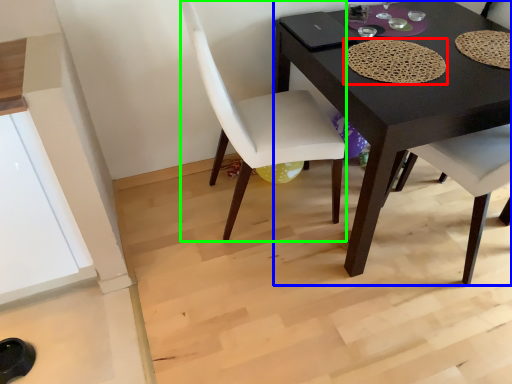
Question: Which object is positioned farthest from mat (highlighted by a red box)? Select from desk (highlighted by a blue box) and chair (highlighted by a green box).

Choices:
 (A) desk
 (B) chair

Answer: (B)